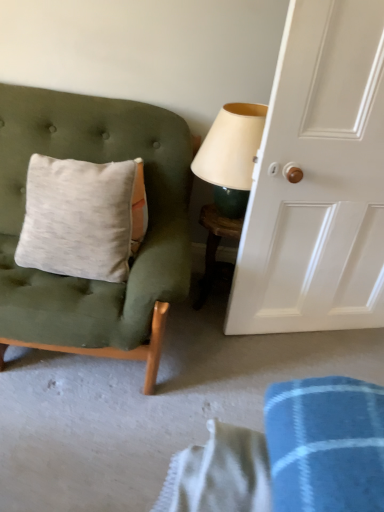
This screenshot has height=512, width=384. Describe the element at coordinates (231, 155) in the screenshot. I see `matte cream lampshade at upper right` at that location.

The width and height of the screenshot is (384, 512). What do you see at coordinates (318, 180) in the screenshot?
I see `white glossy door at right` at bounding box center [318, 180].

Find the location of a particular element. The width and height of the screenshot is (384, 512). matte cream lampshade at upper right is located at coordinates (231, 155).

How different are the orientations of velvet green chair at left and wooden table at center in degrees?

The facing directions of velvet green chair at left and wooden table at center are 5.05 degrees apart.

Between velvet green chair at left and wooden table at center, which one is positioned behind?

wooden table at center.

Which of these two, velvet green chair at left or wooden table at center, stands taller?

With more height is velvet green chair at left.

Is velvet green chair at left wider than wooden table at center?

Indeed, velvet green chair at left has a greater width compared to wooden table at center.

Is white glossy door at right completely or partially outside of matte cream lampshade at upper right?

Absolutely, white glossy door at right is external to matte cream lampshade at upper right.

Which of these two, white glossy door at right or matte cream lampshade at upper right, stands taller?

Standing taller between the two is white glossy door at right.

Considering the positions of points (304, 98) and (253, 122), is point (304, 98) farther from camera compared to point (253, 122)?

No, it is in front of (253, 122).

Based on the photo, is white glossy door at right thinner than matte cream lampshade at upper right?

Yes, white glossy door at right is thinner than matte cream lampshade at upper right.

Does wooden table at center appear on the left side of matte cream lampshade at upper right?

Indeed, wooden table at center is positioned on the left side of matte cream lampshade at upper right.

Does wooden table at center have a lesser height compared to matte cream lampshade at upper right?

Incorrect, the height of wooden table at center does not fall short of that of matte cream lampshade at upper right.

Between wooden table at center and matte cream lampshade at upper right, which one has smaller size?

Smaller between the two is wooden table at center.

Relative to matte cream lampshade at upper right, is wooden table at center in front or behind?

Clearly, wooden table at center is behind matte cream lampshade at upper right.

Considering the sizes of objects wooden table at center and white glossy door at right in the image provided, who is taller, wooden table at center or white glossy door at right?

Standing taller between the two is white glossy door at right.

Which of these two, wooden table at center or white glossy door at right, is thinner?

white glossy door at right is thinner.

Is wooden table at center inside the boundaries of white glossy door at right, or outside?

wooden table at center is not enclosed by white glossy door at right.

From the picture: From a real-world perspective, is wooden table at center on white glossy door at right?

No, from a real-world perspective, wooden table at center is not over white glossy door at right

Is white glossy door at right thinner than wooden table at center?

Indeed, white glossy door at right has a lesser width compared to wooden table at center.

Where is `door above the wooden table at center (from a real-world perspective)`? The height and width of the screenshot is (512, 384). door above the wooden table at center (from a real-world perspective) is located at coordinates point(318,180).

Is the depth of white glossy door at right greater than that of wooden table at center?

No, white glossy door at right is closer to the camera.

Are white glossy door at right and wooden table at center far apart?

They are positioned close to each other.

Considering the sizes of velvet green chair at left and matte cream lampshade at upper right in the image, is velvet green chair at left bigger or smaller than matte cream lampshade at upper right?

velvet green chair at left is bigger than matte cream lampshade at upper right.

Considering the positions of objects velvet green chair at left and matte cream lampshade at upper right in the image provided, who is in front, velvet green chair at left or matte cream lampshade at upper right?

velvet green chair at left.

Considering the sizes of objects velvet green chair at left and matte cream lampshade at upper right in the image provided, who is thinner, velvet green chair at left or matte cream lampshade at upper right?

velvet green chair at left.

Is velvet green chair at left far from matte cream lampshade at upper right?

No, velvet green chair at left is not far away from matte cream lampshade at upper right.

Based on their sizes in the image, would you say matte cream lampshade at upper right is bigger or smaller than white glossy door at right?

In the image, matte cream lampshade at upper right appears to be smaller than white glossy door at right.

From a real-world perspective, which is physically below, matte cream lampshade at upper right or white glossy door at right?

From a 3D spatial view, white glossy door at right is below.

What's the angular difference between matte cream lampshade at upper right and white glossy door at right's facing directions?

14.1 degrees.

Is point (252, 170) farther from viewer compared to point (342, 172)?

No.

Find the location of a particular element. The height and width of the screenshot is (512, 384). table behind the velvet green chair at left is located at coordinates (216, 249).

Where is `table lamp above the white glossy door at right (from a real-world perspective)`? Image resolution: width=384 pixels, height=512 pixels. table lamp above the white glossy door at right (from a real-world perspective) is located at coordinates (231, 155).

When comparing their distances from velvet green chair at left, does white glossy door at right or wooden table at center seem further?

white glossy door at right is positioned further to the anchor velvet green chair at left.

From the image, which object appears to be nearer to velvet green chair at left, matte cream lampshade at upper right or white glossy door at right?

Among the two, matte cream lampshade at upper right is located nearer to velvet green chair at left.

From the image, which object appears to be nearer to white glossy door at right, velvet green chair at left or matte cream lampshade at upper right?

matte cream lampshade at upper right is closer to white glossy door at right.

Which object lies nearer to the anchor point wooden table at center, velvet green chair at left or white glossy door at right?

white glossy door at right is closer to wooden table at center.

Estimate the real-world distances between objects in this image. Which object is closer to white glossy door at right, matte cream lampshade at upper right or wooden table at center?

The object closer to white glossy door at right is matte cream lampshade at upper right.

Looking at the image, which one is located closer to wooden table at center, velvet green chair at left or matte cream lampshade at upper right?

matte cream lampshade at upper right.

From the image, which object appears to be nearer to wooden table at center, matte cream lampshade at upper right or velvet green chair at left?

matte cream lampshade at upper right is closer to wooden table at center.

Estimate the real-world distances between objects in this image. Which object is further from matte cream lampshade at upper right, white glossy door at right or velvet green chair at left?

velvet green chair at left is positioned further to the anchor matte cream lampshade at upper right.

Identify the location of table situated between velvet green chair at left and white glossy door at right from left to right. The image size is (384, 512). (216, 249).

Find the location of `table lamp located between velvet green chair at left and white glossy door at right in the left-right direction`. table lamp located between velvet green chair at left and white glossy door at right in the left-right direction is located at coordinates (231, 155).

You are a GUI agent. You are given a task and a screenshot of the screen. Output one action in this format:
    pyautogui.click(x=<x>, y=<y>)
    Task: Click on the table between velvet green chair at left and matte cream lampshade at upper right
    
    Given the screenshot: What is the action you would take?
    pyautogui.click(x=216, y=249)

Where is `table lamp located between white glossy door at right and wooden table at center in the depth direction`? The image size is (384, 512). table lamp located between white glossy door at right and wooden table at center in the depth direction is located at coordinates (231, 155).